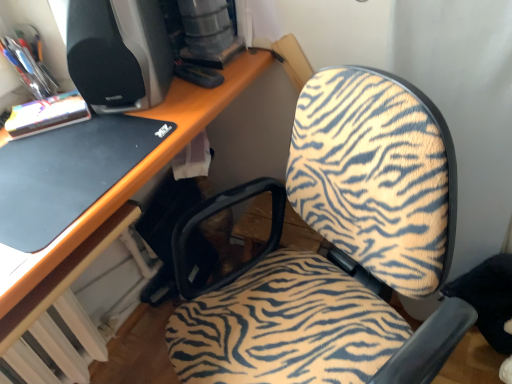
Question: Should I look upward or downward to see zebra-patterned fabric chair at center?

Choices:
 (A) down
 (B) up

Answer: (A)

Question: Is black matte laptop at left surrounding black plastic desktop computer at upper left?

Choices:
 (A) yes
 (B) no

Answer: (B)

Question: Could you tell me if black matte laptop at left is turned towards black plastic desktop computer at upper left?

Choices:
 (A) yes
 (B) no

Answer: (B)

Question: Is black matte laptop at left wider than black plastic desktop computer at upper left?

Choices:
 (A) no
 (B) yes

Answer: (B)

Question: Is black matte laptop at left placed right next to black plastic desktop computer at upper left?

Choices:
 (A) no
 (B) yes

Answer: (A)

Question: Is black matte laptop at left far from black plastic desktop computer at upper left?

Choices:
 (A) yes
 (B) no

Answer: (B)

Question: Does black matte laptop at left have a larger size compared to black plastic desktop computer at upper left?

Choices:
 (A) no
 (B) yes

Answer: (A)

Question: Is zebra-patterned fabric chair at center wider than black matte laptop at left?

Choices:
 (A) yes
 (B) no

Answer: (A)

Question: Considering the relative positions of zebra-patterned fabric chair at center and black matte laptop at left in the image provided, is zebra-patterned fabric chair at center to the left of black matte laptop at left from the viewer's perspective?

Choices:
 (A) no
 (B) yes

Answer: (A)

Question: Can you confirm if zebra-patterned fabric chair at center is bigger than black matte laptop at left?

Choices:
 (A) yes
 (B) no

Answer: (A)

Question: Is zebra-patterned fabric chair at center positioned behind black matte laptop at left?

Choices:
 (A) no
 (B) yes

Answer: (A)

Question: Is zebra-patterned fabric chair at center surrounding black matte laptop at left?

Choices:
 (A) no
 (B) yes

Answer: (A)

Question: From a real-world perspective, is zebra-patterned fabric chair at center positioned under black matte laptop at left based on gravity?

Choices:
 (A) no
 (B) yes

Answer: (B)

Question: Does black matte laptop at left have a smaller size compared to zebra-patterned fabric chair at center?

Choices:
 (A) no
 (B) yes

Answer: (B)